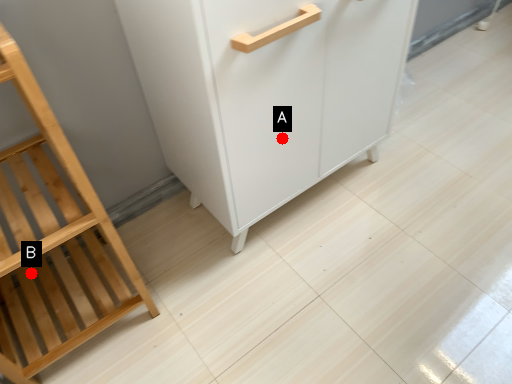
Question: Two points are circled on the image, labeled by A and B beside each circle. Among these points, which one is nearest to the camera?

Choices:
 (A) A is closer
 (B) B is closer

Answer: (A)